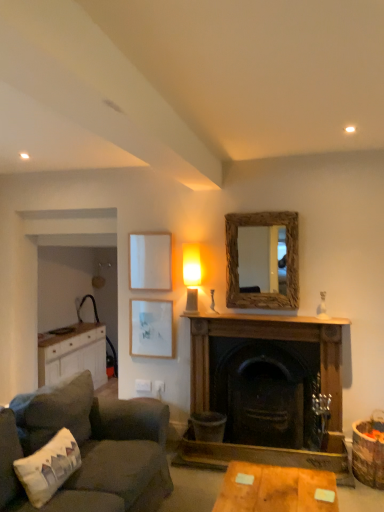
You are a GUI agent. You are given a task and a screenshot of the screen. Output one action in this format:
    pyautogui.click(x=<x>, y=<y>)
    Task: Click on the empty space that is ontop of wooden mantelpiece at center
    The image size is (384, 512).
    Given the screenshot: What is the action you would take?
    pyautogui.click(x=263, y=315)